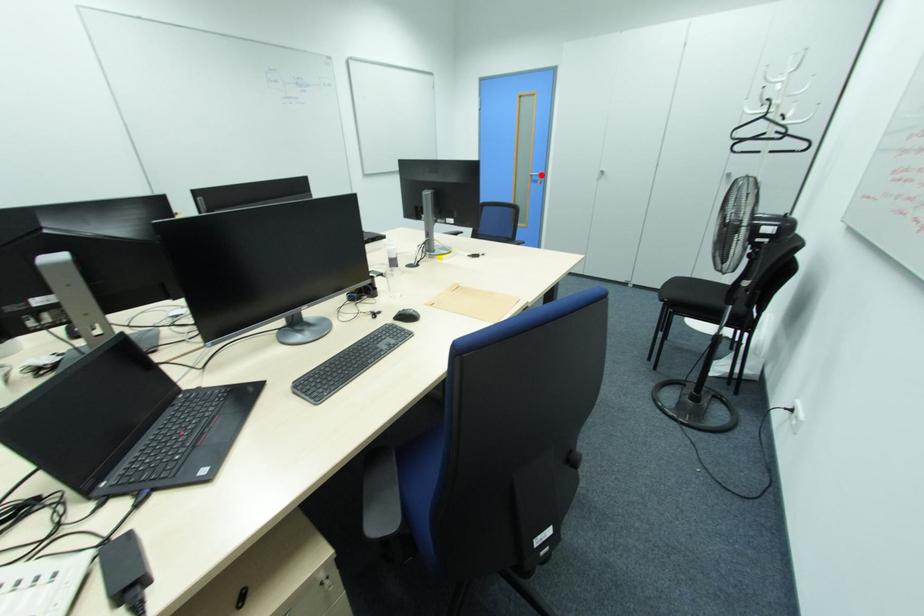
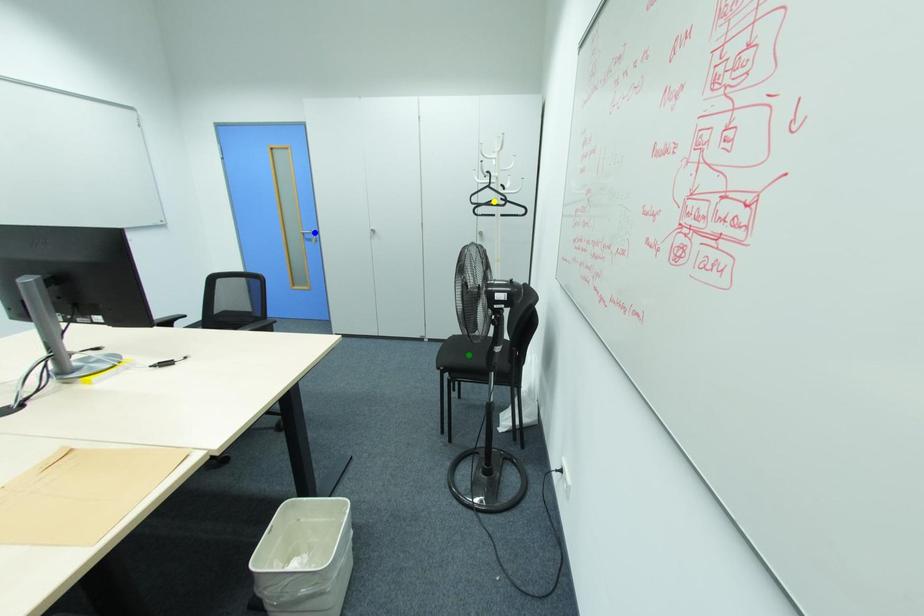
Question: I am providing you with two images of the same scene from different viewpoints. A red point is marked on the first image. You are given multiple points on the second image. Which point in image 2 is actually the same real-world point as the red point in image 1?

Choices:
 (A) blue point
 (B) yellow point
 (C) green point

Answer: (A)